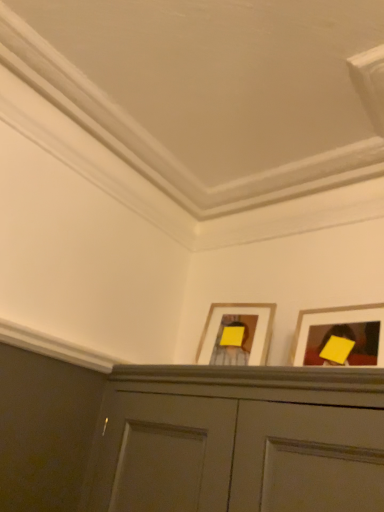
Question: Is yellow matte picture frame at upper center, the first picture frame in the left-to-right sequence, aimed at yellow matte picture frame at upper right, placed as the 2th picture frame when sorted from left to right?

Choices:
 (A) yes
 (B) no

Answer: (B)

Question: Does yellow matte picture frame at upper center, the second picture frame in the right-to-left sequence, appear on the right side of yellow matte picture frame at upper right, the 1th picture frame viewed from the front?

Choices:
 (A) no
 (B) yes

Answer: (A)

Question: Is yellow matte picture frame at upper center, which is the 2th picture frame from front to back, smaller than yellow matte picture frame at upper right, which is the second picture frame in back-to-front order?

Choices:
 (A) no
 (B) yes

Answer: (A)

Question: Is yellow matte picture frame at upper center, the second picture frame in the right-to-left sequence, directly adjacent to yellow matte picture frame at upper right, the 1th picture frame viewed from the front?

Choices:
 (A) yes
 (B) no

Answer: (B)

Question: From the image's perspective, is yellow matte picture frame at upper center, the 1th picture frame viewed from the back, located beneath yellow matte picture frame at upper right, placed as the 2th picture frame when sorted from left to right?

Choices:
 (A) yes
 (B) no

Answer: (A)

Question: Is the position of yellow matte picture frame at upper center, the first picture frame in the left-to-right sequence, less distant than that of yellow matte picture frame at upper right, the 1th picture frame viewed from the front?

Choices:
 (A) no
 (B) yes

Answer: (A)

Question: Is yellow matte picture frame at upper right, placed as the 2th picture frame when sorted from left to right, at the left side of yellow matte picture frame at upper center, the first picture frame in the left-to-right sequence?

Choices:
 (A) no
 (B) yes

Answer: (A)

Question: Can you confirm if yellow matte picture frame at upper right, arranged as the 1th picture frame when viewed from the right, is positioned to the right of yellow matte picture frame at upper center, the second picture frame in the right-to-left sequence?

Choices:
 (A) no
 (B) yes

Answer: (B)

Question: Considering the relative sizes of yellow matte picture frame at upper right, which is the second picture frame in back-to-front order, and yellow matte picture frame at upper center, the second picture frame in the right-to-left sequence, in the image provided, is yellow matte picture frame at upper right, which is the second picture frame in back-to-front order, shorter than yellow matte picture frame at upper center, the second picture frame in the right-to-left sequence,?

Choices:
 (A) no
 (B) yes

Answer: (A)

Question: From a real-world perspective, is yellow matte picture frame at upper right, arranged as the 1th picture frame when viewed from the right, positioned over yellow matte picture frame at upper center, which is the 2th picture frame from front to back, based on gravity?

Choices:
 (A) no
 (B) yes

Answer: (A)

Question: Does yellow matte picture frame at upper right, the 1th picture frame viewed from the front, have a smaller size compared to yellow matte picture frame at upper center, the second picture frame in the right-to-left sequence?

Choices:
 (A) no
 (B) yes

Answer: (B)

Question: Is yellow matte picture frame at upper right, placed as the 2th picture frame when sorted from left to right, facing towards yellow matte picture frame at upper center, which is the 2th picture frame from front to back?

Choices:
 (A) no
 (B) yes

Answer: (A)

Question: From the image's perspective, relative to yellow matte picture frame at upper right, arranged as the 1th picture frame when viewed from the right, is yellow matte picture frame at upper center, the first picture frame in the left-to-right sequence, above or below?

Choices:
 (A) above
 (B) below

Answer: (B)